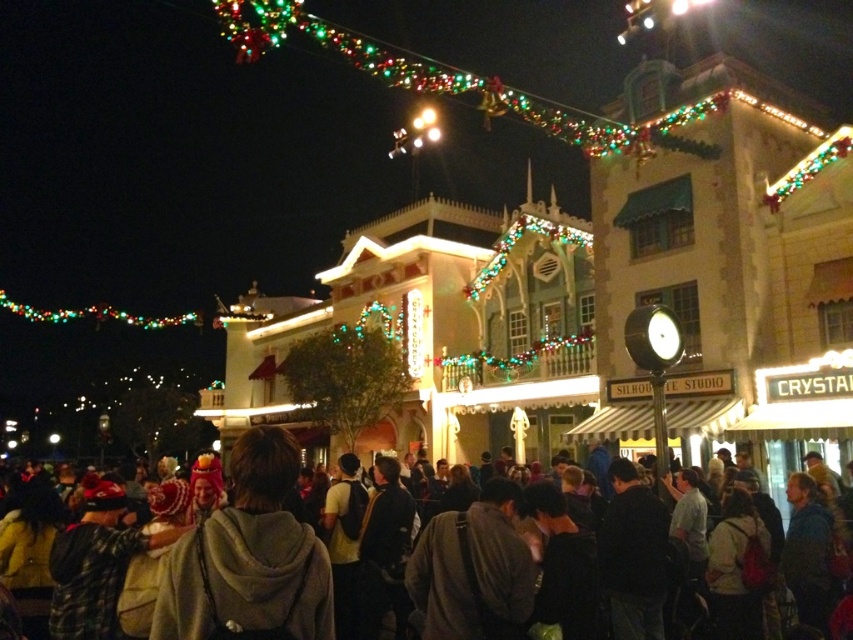
Between light brown hoodie at center and multicolored string lights at upper center, which one has less height?

With less height is light brown hoodie at center.

Which is below, light brown hoodie at center or multicolored string lights at upper center?

light brown hoodie at center

I want to click on light brown hoodie at center, so click(x=248, y=557).

The width and height of the screenshot is (853, 640). Identify the location of light brown hoodie at center. (248, 557).

Who is more distant from viewer, [285,436] or [567,131]?

Positioned behind is point [567,131].

Can you confirm if dark gray hoodie at center is thinner than multicolored string lights at upper center?

Yes, dark gray hoodie at center is thinner than multicolored string lights at upper center.

Which is in front, point (0, 625) or point (469, 88)?

Point (0, 625) is in front.

Find the location of a particular element. dark gray hoodie at center is located at coordinates (265, 472).

Between light brown hoodie at center and dark gray hoodie at center, which one has more height?

dark gray hoodie at center is taller.

Who is positioned more to the left, light brown hoodie at center or dark gray hoodie at center?

light brown hoodie at center

Find the location of a particular element. The height and width of the screenshot is (640, 853). light brown hoodie at center is located at coordinates (248, 557).